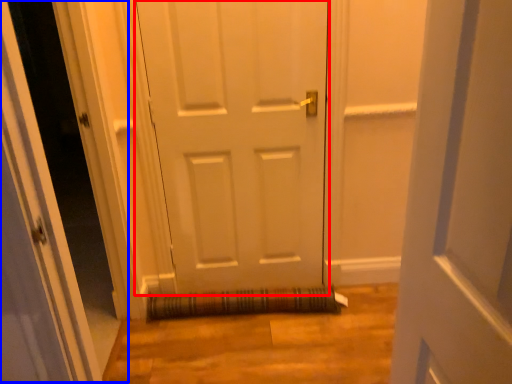
Question: Which object is further to the camera taking this photo, door (highlighted by a red box) or glass door (highlighted by a blue box)?

Choices:
 (A) door
 (B) glass door

Answer: (A)